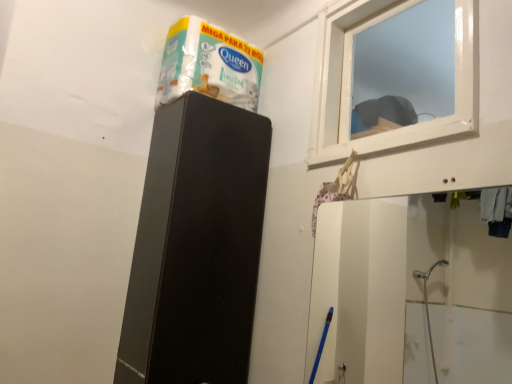
Question: From their relative heights in the image, would you say transparent plastic window at upper right is taller or shorter than black matte speaker at upper center?

Choices:
 (A) short
 (B) tall

Answer: (A)

Question: From a real-world perspective, relative to black matte speaker at upper center, is transparent plastic window at upper right vertically above or below?

Choices:
 (A) below
 (B) above

Answer: (B)

Question: Which object is positioned closest to the transparent plastic window at upper right?

Choices:
 (A) white glossy tissue box at upper center
 (B) black matte speaker at upper center

Answer: (A)

Question: Which of these objects is positioned closest to the transparent plastic window at upper right?

Choices:
 (A) white glossy tissue box at upper center
 (B) black matte speaker at upper center

Answer: (A)